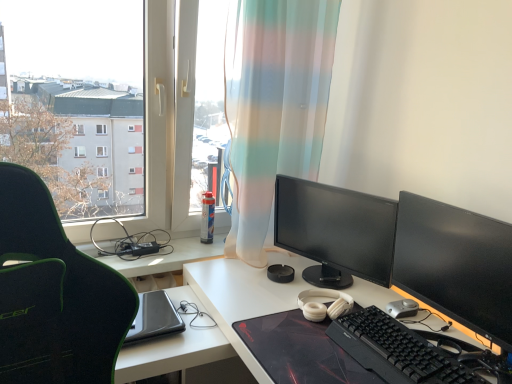
I want to click on free space behind silver metallic mouse at lower right, so click(382, 293).